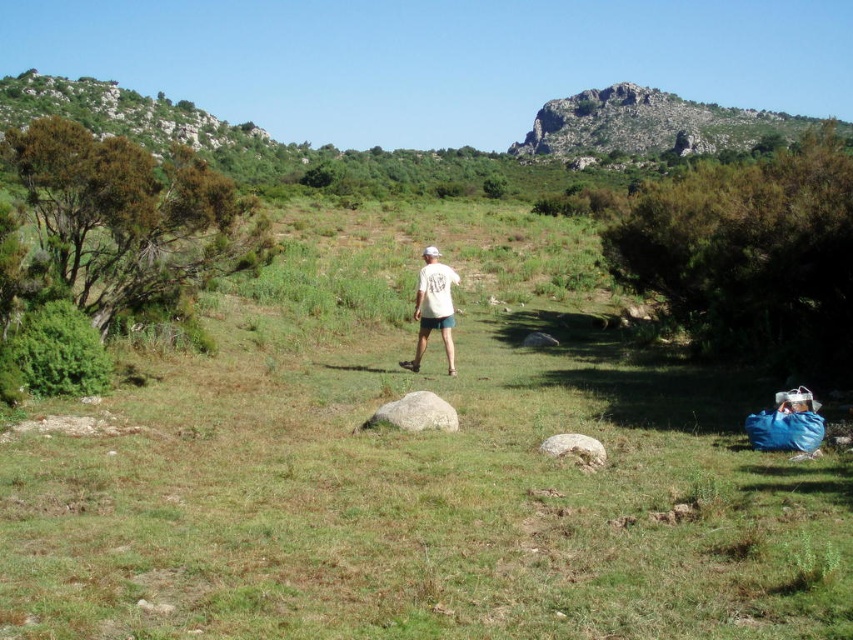
You are standing at the point marked as point [415,470] in the image. Looking around, you see a blue bag on the right side. Which direction should you walk to reach the blue bag?

Since the blue bag is on the right side of the image and you are at point [415,470] on the green grassy field at center, you should walk towards the right to reach the blue bag.

You are a photographer trying to capture a clear shot of the white cotton shirt at center. However, the green grassy field at center is obstructing your view. Can you determine if the grass is taller than the shirt?

The green grassy field at center is much taller than the white cotton shirt at center, so the grass is obstructing the view of the shirt.

You are standing at the edge of the scene and want to walk towards the gray smooth rock at center. Which direction should you go relative to the green grassy field at center?

You should go to the right of the green grassy field at center because the gray smooth rock at center is to the right of the green grassy field at center.